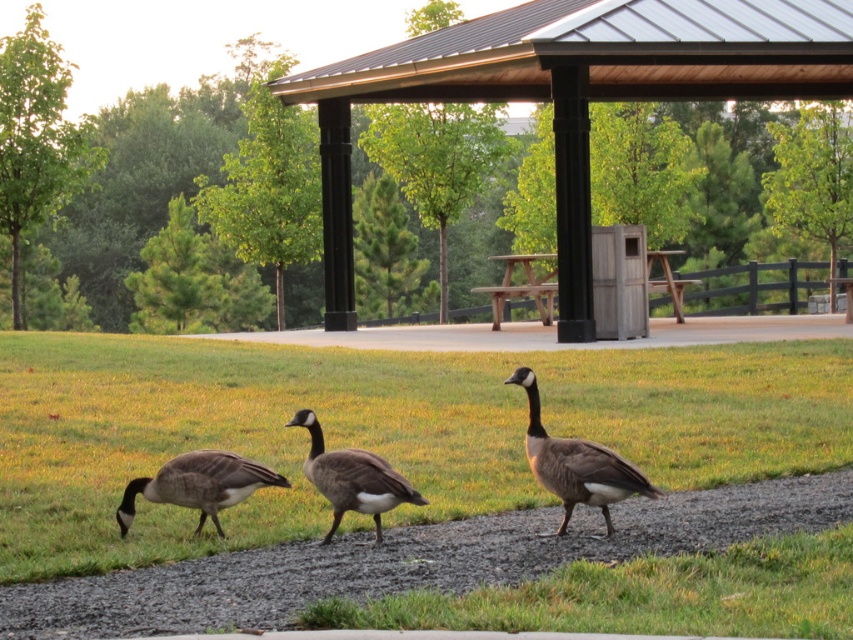
Is brown wood pavilion at center wider than gray matte goose at center?

Correct, the width of brown wood pavilion at center exceeds that of gray matte goose at center.

What do you see at coordinates (572, 93) in the screenshot? Image resolution: width=853 pixels, height=640 pixels. I see `brown wood pavilion at center` at bounding box center [572, 93].

This screenshot has width=853, height=640. Describe the element at coordinates (572, 93) in the screenshot. I see `brown wood pavilion at center` at that location.

The image size is (853, 640). In order to click on brown wood pavilion at center in this screenshot , I will do `click(572, 93)`.

Does green grass at lower center lie in front of brown matte duck at lower left?

Yes, it is.

Can you confirm if green grass at lower center is thinner than brown matte duck at lower left?

Incorrect, green grass at lower center's width is not less than brown matte duck at lower left's.

The height and width of the screenshot is (640, 853). What are the coordinates of `green grass at lower center` in the screenshot? It's located at (374, 429).

Where is `green grass at lower center`? This screenshot has width=853, height=640. green grass at lower center is located at coordinates (374, 429).

Consider the image. Which of these two, green grass at lower center or gray matte goose at center, stands taller?

green grass at lower center

Who is more forward, [744,348] or [607,452]?

Point [607,452] is more forward.

Find the location of `green grass at lower center`. green grass at lower center is located at coordinates (374, 429).